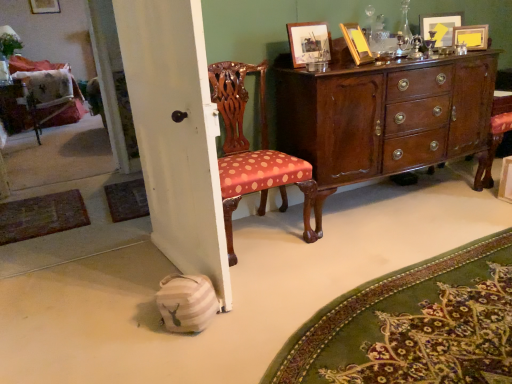
Where is `empty space that is ontop of woven brown mat at lower left, which ranks as the 1th mat in back-to-front order (from a real-world perspective)`? Image resolution: width=512 pixels, height=384 pixels. empty space that is ontop of woven brown mat at lower left, which ranks as the 1th mat in back-to-front order (from a real-world perspective) is located at coordinates (121, 194).